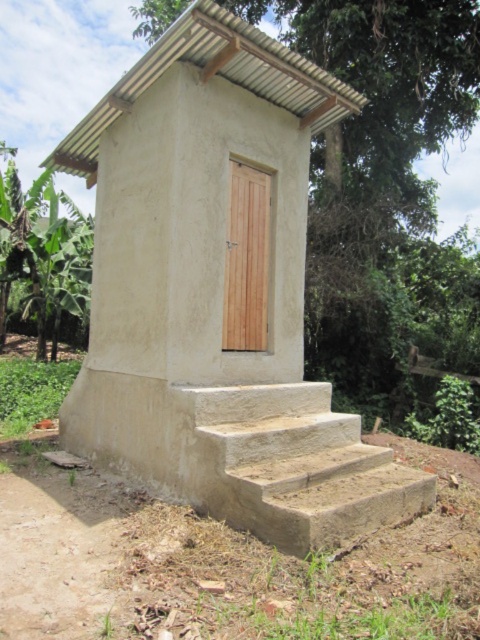
Question: Among these objects, which one is nearest to the camera?

Choices:
 (A) light brown concrete stairs at lower center
 (B) green leafy banana tree at left

Answer: (A)

Question: Which point is farther to the camera?

Choices:
 (A) matte concrete hut at center
 (B) green leafy banana tree at left
 (C) light brown concrete stairs at lower center
 (D) light brown wood door at center

Answer: (B)

Question: Is matte concrete hut at center to the left of light brown wood door at center from the viewer's perspective?

Choices:
 (A) yes
 (B) no

Answer: (A)

Question: Estimate the real-world distances between objects in this image. Which object is closer to the green leafy banana tree at left?

Choices:
 (A) light brown wood door at center
 (B) light brown concrete stairs at lower center
 (C) matte concrete hut at center

Answer: (C)

Question: From the image, what is the correct spatial relationship of matte concrete hut at center in relation to light brown wood door at center?

Choices:
 (A) above
 (B) below

Answer: (B)

Question: Does matte concrete hut at center appear on the left side of light brown concrete stairs at lower center?

Choices:
 (A) no
 (B) yes

Answer: (B)